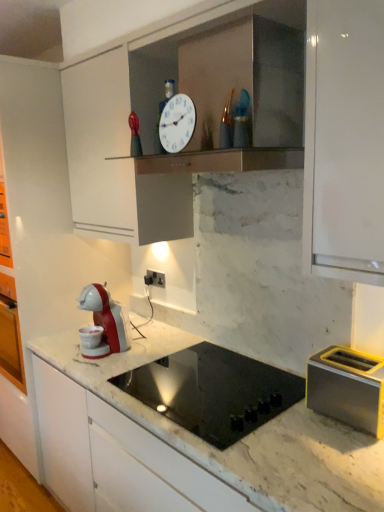
Image resolution: width=384 pixels, height=512 pixels. What are the coordinates of `metallic yellow toaster at right` in the screenshot? It's located at coord(347,388).

Locate an element on the screen. The image size is (384, 512). black plastic electric outlet at center is located at coordinates (155, 278).

Is black plastic electric outlet at center thinner than white glossy clock at upper center?

No, black plastic electric outlet at center is not thinner than white glossy clock at upper center.

Are black plastic electric outlet at center and white glossy clock at upper center making contact?

There is a gap between black plastic electric outlet at center and white glossy clock at upper center.

In the scene shown: From the image's perspective, would you say black plastic electric outlet at center is shown under white glossy clock at upper center?

Yes, from the image's perspective, black plastic electric outlet at center is beneath white glossy clock at upper center.

Does black plastic electric outlet at center turn towards white glossy clock at upper center?

No, black plastic electric outlet at center is not oriented towards white glossy clock at upper center.

Is point (146, 277) behind point (180, 382)?

Yes.

Is black plastic electric outlet at center at the right side of black glass cooktop at center?

No.

From the image's perspective, is black plastic electric outlet at center over black glass cooktop at center?

Yes.

In the scene shown: Can you confirm if black plastic electric outlet at center is shorter than metallic yellow toaster at right?

Indeed, black plastic electric outlet at center has a lesser height compared to metallic yellow toaster at right.

Could you tell me if black plastic electric outlet at center is turned towards metallic yellow toaster at right?

No, black plastic electric outlet at center is not aimed at metallic yellow toaster at right.

What are the coordinates of `electric outlet located above the metallic yellow toaster at right (from a real-world perspective)` in the screenshot? It's located at (155, 278).

Is black plastic electric outlet at center to the left or to the right of metallic yellow toaster at right in the image?

Based on their positions, black plastic electric outlet at center is located to the left of metallic yellow toaster at right.

Which of these two, black glass cooktop at center or white glossy clock at upper center, is smaller?

With smaller size is white glossy clock at upper center.

Does point (218, 351) come farther from viewer compared to point (164, 149)?

Yes.

From the image's perspective, is black glass cooktop at center on white glossy clock at upper center?

Incorrect, from the image's perspective, black glass cooktop at center is lower than white glossy clock at upper center.

Considering the sizes of objects black glass cooktop at center and white glossy clock at upper center in the image provided, who is thinner, black glass cooktop at center or white glossy clock at upper center?

Thinner between the two is white glossy clock at upper center.

Between metallic yellow toaster at right and black plastic electric outlet at center, which one appears on the left side from the viewer's perspective?

From the viewer's perspective, black plastic electric outlet at center appears more on the left side.

Which of these two, metallic yellow toaster at right or black plastic electric outlet at center, stands taller?

metallic yellow toaster at right is taller.

Based on the photo, from the image's perspective, is metallic yellow toaster at right above or below black plastic electric outlet at center?

From the image's perspective, metallic yellow toaster at right appears below black plastic electric outlet at center.

Considering the sizes of objects metallic yellow toaster at right and black plastic electric outlet at center in the image provided, who is wider, metallic yellow toaster at right or black plastic electric outlet at center?

metallic yellow toaster at right.

Is black glass cooktop at center in front of metallic yellow toaster at right?

No, black glass cooktop at center is behind metallic yellow toaster at right.

From a real-world perspective, is black glass cooktop at center positioned above or below metallic yellow toaster at right?

black glass cooktop at center is below metallic yellow toaster at right.

Is black glass cooktop at center far from metallic yellow toaster at right?

No, black glass cooktop at center is in close proximity to metallic yellow toaster at right.

Which of these two, black glass cooktop at center or metallic yellow toaster at right, stands shorter?

black glass cooktop at center is shorter.

Considering the sizes of objects black glass cooktop at center and black plastic electric outlet at center in the image provided, who is wider, black glass cooktop at center or black plastic electric outlet at center?

black glass cooktop at center is wider.

Is black glass cooktop at center shorter than black plastic electric outlet at center?

No.

Identify the location of gas stove in front of the black plastic electric outlet at center. This screenshot has width=384, height=512. (213, 391).

What are the coordinates of `electric outlet that appears behind the white glossy clock at upper center` in the screenshot? It's located at (155, 278).

Locate an element on the screen. gas stove below the black plastic electric outlet at center (from a real-world perspective) is located at coordinates (213, 391).

When comparing their distances from black plastic electric outlet at center, does metallic yellow toaster at right or white glossy clock at upper center seem further?

Based on the image, metallic yellow toaster at right appears to be further to black plastic electric outlet at center.

Looking at the image, which one is located closer to white glossy clock at upper center, black plastic electric outlet at center or metallic yellow toaster at right?

The object closer to white glossy clock at upper center is metallic yellow toaster at right.

Estimate the real-world distances between objects in this image. Which object is further from metallic yellow toaster at right, black plastic electric outlet at center or black glass cooktop at center?

black plastic electric outlet at center lies further to metallic yellow toaster at right than the other object.

Estimate the real-world distances between objects in this image. Which object is closer to black glass cooktop at center, white glossy clock at upper center or black plastic electric outlet at center?

black plastic electric outlet at center is positioned closer to the anchor black glass cooktop at center.

Estimate the real-world distances between objects in this image. Which object is further from metallic yellow toaster at right, black plastic electric outlet at center or white glossy clock at upper center?

The object further to metallic yellow toaster at right is black plastic electric outlet at center.

Looking at the image, which one is located closer to black plastic electric outlet at center, black glass cooktop at center or metallic yellow toaster at right?

Based on the image, black glass cooktop at center appears to be nearer to black plastic electric outlet at center.

Based on their spatial positions, is white glossy clock at upper center or black plastic electric outlet at center further from metallic yellow toaster at right?

black plastic electric outlet at center is positioned further to the anchor metallic yellow toaster at right.

Based on their spatial positions, is white glossy clock at upper center or metallic yellow toaster at right further from black plastic electric outlet at center?

metallic yellow toaster at right.

Where is `kitchen appliance between white glossy clock at upper center and black glass cooktop at center vertically`? kitchen appliance between white glossy clock at upper center and black glass cooktop at center vertically is located at coordinates (347, 388).

Locate an element on the screen. clock located between black glass cooktop at center and black plastic electric outlet at center in the depth direction is located at coordinates (177, 123).

Identify the location of gas stove positioned between metallic yellow toaster at right and black plastic electric outlet at center from near to far. (213, 391).

The width and height of the screenshot is (384, 512). What are the coordinates of `clock between metallic yellow toaster at right and black plastic electric outlet at center in the front-back direction` in the screenshot? It's located at (177, 123).